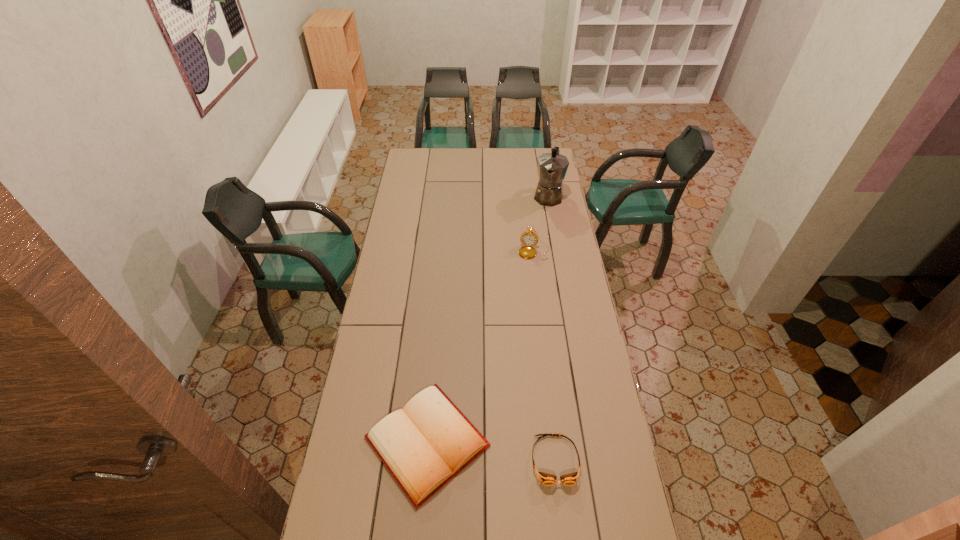
The height and width of the screenshot is (540, 960). I want to click on vacant area at the far edge, so pos(511,160).

In the image, there is a desktop. At what (x,y) coordinates should I click in order to perform the action: click on free space at the near edge. Please return your answer as a coordinate pair (x, y). Looking at the image, I should click on (574, 502).

The width and height of the screenshot is (960, 540). What are the coordinates of `free space at the left edge of the desktop` in the screenshot? It's located at click(x=409, y=271).

This screenshot has width=960, height=540. In the image, there is a desktop. In order to click on vacant area at the right edge in this screenshot , I will do `click(542, 224)`.

Find the location of `unoccupied position between the pocket watch and the Bible`. unoccupied position between the pocket watch and the Bible is located at coordinates (481, 347).

At what (x,y) coordinates should I click in order to perform the action: click on free space between the goggles and the second tallest object. Please return your answer as a coordinate pair (x, y). The height and width of the screenshot is (540, 960). Looking at the image, I should click on (544, 356).

What are the coordinates of `vacant point located between the coffeepot and the leftmost object` in the screenshot? It's located at (488, 319).

The width and height of the screenshot is (960, 540). In order to click on empty space that is in between the coffeepot and the third nearest object in this screenshot , I will do `click(541, 224)`.

The image size is (960, 540). Identify the location of vacant region between the tallest object and the leftmost object. (488, 319).

Locate an element on the screen. This screenshot has height=540, width=960. free space that is in between the third nearest object and the goggles is located at coordinates (544, 356).